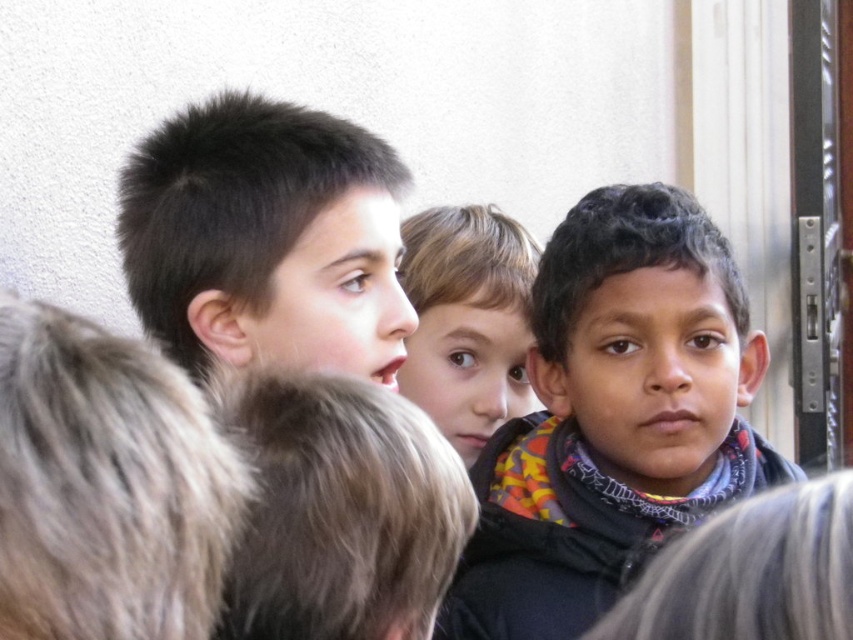
Does multicolored scarf at center appear under smooth brown hair at center?

Yes, multicolored scarf at center is below smooth brown hair at center.

Which is more to the left, multicolored scarf at center or smooth brown hair at center?

smooth brown hair at center is more to the left.

Describe the element at coordinates (614, 417) in the screenshot. This screenshot has height=640, width=853. I see `multicolored scarf at center` at that location.

Where is `multicolored scarf at center`? The height and width of the screenshot is (640, 853). multicolored scarf at center is located at coordinates (614, 417).

Does dark brown hair at center appear on the left side of smooth brown hair at center?

Correct, you'll find dark brown hair at center to the left of smooth brown hair at center.

Looking at this image, does dark brown hair at center come behind smooth brown hair at center?

No.

Between point (398, 211) and point (413, 346), which one is positioned in front?

Point (398, 211) is in front.

At what (x,y) coordinates should I click in order to perform the action: click on dark brown hair at center. Please return your answer as a coordinate pair (x, y). The width and height of the screenshot is (853, 640). Looking at the image, I should click on (265, 237).

Can you confirm if multicolored scarf at center is smaller than dark brown hair at center?

No, multicolored scarf at center is not smaller than dark brown hair at center.

Can you confirm if multicolored scarf at center is taller than dark brown hair at center?

Correct, multicolored scarf at center is much taller as dark brown hair at center.

What are the coordinates of `multicolored scarf at center` in the screenshot? It's located at (614, 417).

The width and height of the screenshot is (853, 640). Identify the location of multicolored scarf at center. (614, 417).